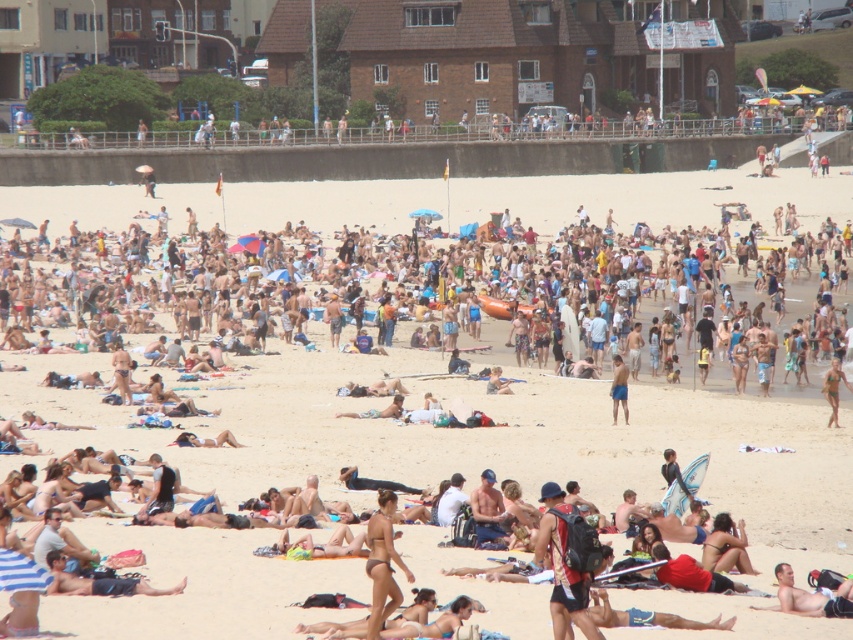
Based on the scene description, which object is wider, the beige sand crowd at center or the tan skin man at center?

The beige sand crowd at center is wider than the tan skin man at center according to the description.

You are a lifeguard standing at the edge of the beach. You notice a swimmer in distress 100 meters away from the shore. You need to quickly reach them using the shortest path possible. There are two objects in your line of sight that might help you navigate the sand efficiently. The beige sand crowd at center and the red fabric swimsuit at center are both located at the center of the beach. Considering the distance between them, which direction should you head towards to minimize the distance to the swimmer

The distance between the beige sand crowd at center and the red fabric swimsuit at center is 56.69 meters. Since both are at the center, you should head directly towards the center where they are located to minimize the distance to the swimmer.

You are standing on the beach and want to walk from point A to point B. Point A is at coordinate point (254,266) and point B is at coordinate point (563,636). Since you can only move forward, which direction should you face to walk directly from point A to point B?

To walk directly from point A to point B, you should face towards the direction of point B, which is located further away from the viewer compared to point A. Since point A is closer to you, you need to move towards the direction where point B is situated, which is behind point A from your current position.